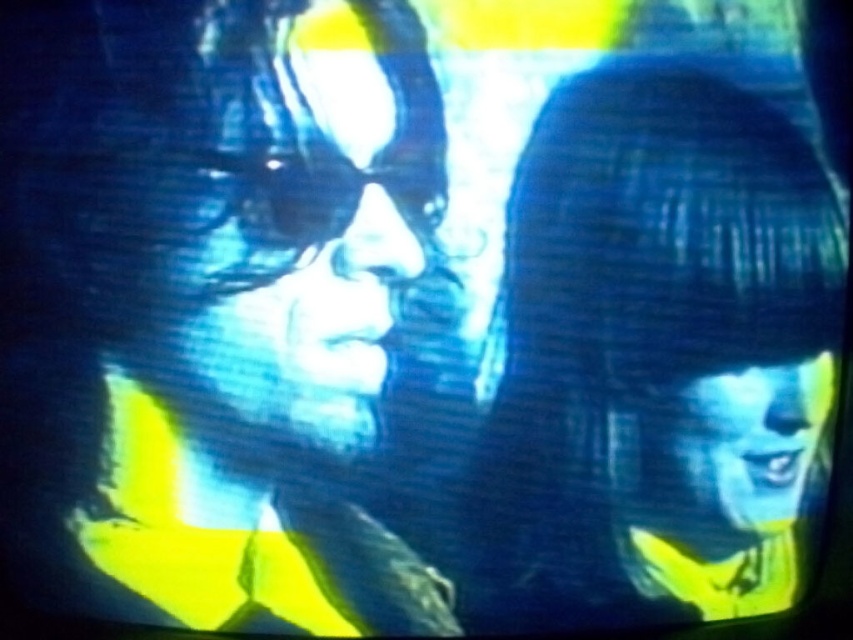
Based on the scene described, which object has a greater height between the matte blue face at left and the blue matte face at lower right?

The matte blue face at left has a greater height compared to the blue matte face at lower right.